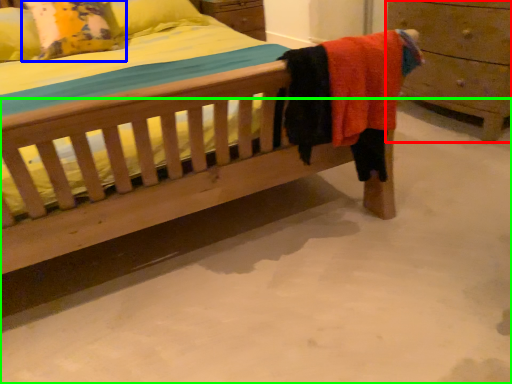
Question: Which object is the farthest from chest of drawers (highlighted by a red box)? Choose among these: pillow (highlighted by a blue box) or concrete (highlighted by a green box).

Choices:
 (A) pillow
 (B) concrete

Answer: (A)